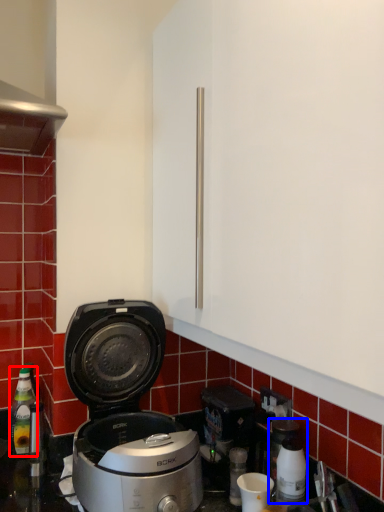
Question: Among these objects, which one is farthest to the camera, bottle (highlighted by a red box) or coffee machine (highlighted by a blue box)?

Choices:
 (A) bottle
 (B) coffee machine

Answer: (A)